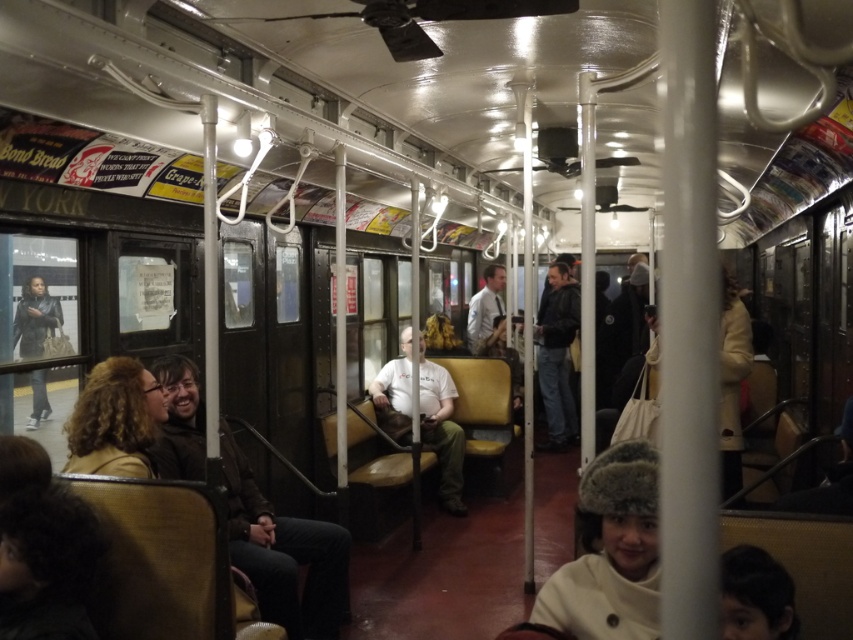
Which is more to the left, dark brown leather jacket at center or dark blue jeans at center?

dark brown leather jacket at center is more to the left.

Does dark brown leather jacket at center have a smaller size compared to dark blue jeans at center?

No, dark brown leather jacket at center is not smaller than dark blue jeans at center.

Looking at this image, who is more forward, [180,365] or [566,333]?

Point [180,365]

Where is `dark brown leather jacket at center`? This screenshot has width=853, height=640. dark brown leather jacket at center is located at coordinates (283, 554).

Who is more forward, (306,572) or (422,387)?

Point (306,572) is in front.

Can you confirm if dark brown leather jacket at center is thinner than light brown leather jacket at center?

Incorrect, dark brown leather jacket at center's width is not less than light brown leather jacket at center's.

Does point (337, 588) come closer to viewer compared to point (456, 492)?

Yes.

This screenshot has height=640, width=853. Identify the location of dark brown leather jacket at center. (283, 554).

Who is lower down, light brown leather jacket at center or dark blue jeans at center?

light brown leather jacket at center is below.

Who is taller, light brown leather jacket at center or dark blue jeans at center?

dark blue jeans at center is taller.

Locate an element on the screen. This screenshot has height=640, width=853. light brown leather jacket at center is located at coordinates (440, 429).